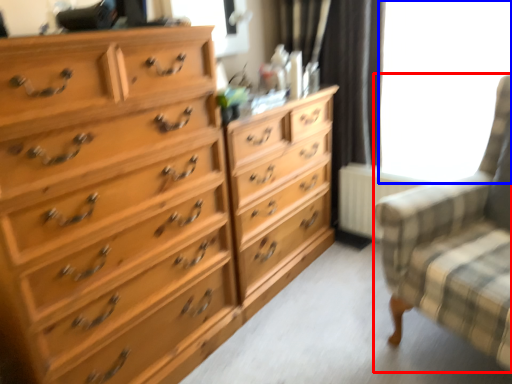
Question: Which object appears closest to the camera in this image, rocking chair (highlighted by a red box) or window screen (highlighted by a blue box)?

Choices:
 (A) rocking chair
 (B) window screen

Answer: (A)